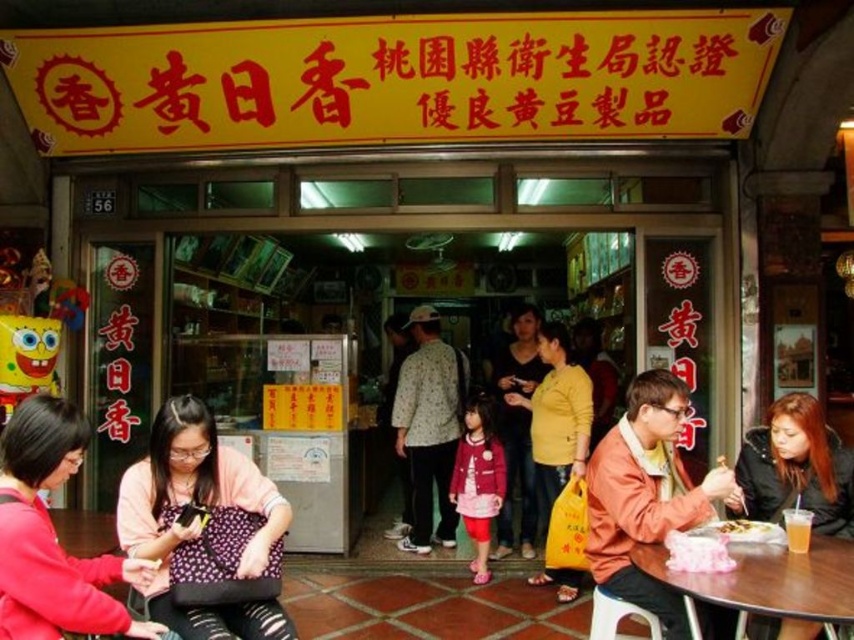
Is patterned fabric bag at center smaller than white plastic stool at lower right?

No, patterned fabric bag at center is not smaller than white plastic stool at lower right.

Between point (264, 609) and point (612, 625), which one is positioned in front?

Positioned in front is point (264, 609).

The width and height of the screenshot is (854, 640). What do you see at coordinates (203, 528) in the screenshot?
I see `patterned fabric bag at center` at bounding box center [203, 528].

The image size is (854, 640). I want to click on patterned fabric bag at center, so click(x=203, y=528).

Is point (98, 566) positioned behind point (509, 550)?

That is False.

The width and height of the screenshot is (854, 640). In order to click on matte purple shirt at center in this screenshot , I will do (x=53, y=536).

Between dark brown leather jacket at lower right and white paper plate at lower center, which one is positioned higher?

dark brown leather jacket at lower right is higher up.

The image size is (854, 640). What do you see at coordinates (794, 468) in the screenshot?
I see `dark brown leather jacket at lower right` at bounding box center [794, 468].

The image size is (854, 640). I want to click on dark brown leather jacket at lower right, so click(794, 468).